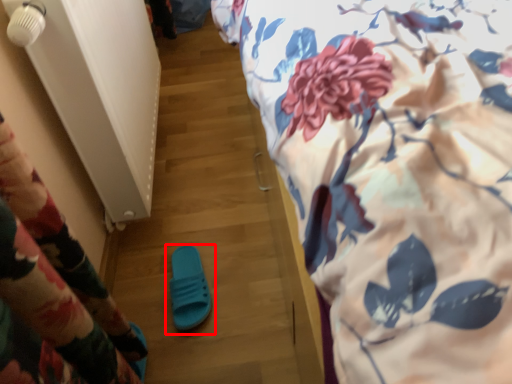
Question: From the image's perspective, where is footwear (annotated by the red box) located in relation to bed in the image?

Choices:
 (A) above
 (B) below

Answer: (B)